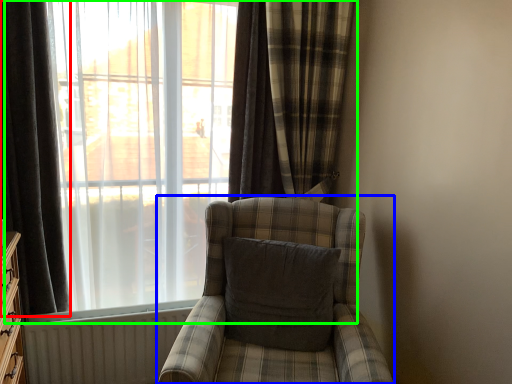
Question: Which is nearer to the curtain (highlighted by a red box)? chair (highlighted by a blue box) or window (highlighted by a green box).

Choices:
 (A) chair
 (B) window

Answer: (B)